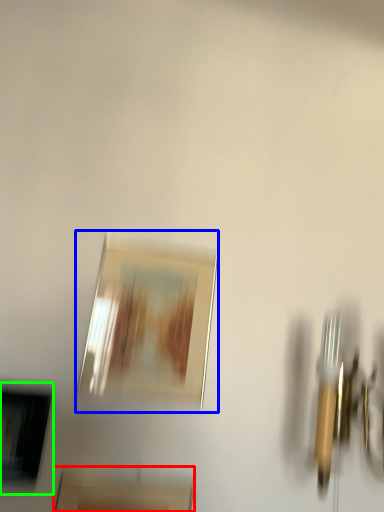
Question: Which is farther away from picture frame (highlighted by a red box)? picture frame (highlighted by a blue box) or picture frame (highlighted by a green box)?

Choices:
 (A) picture frame
 (B) picture frame

Answer: (A)